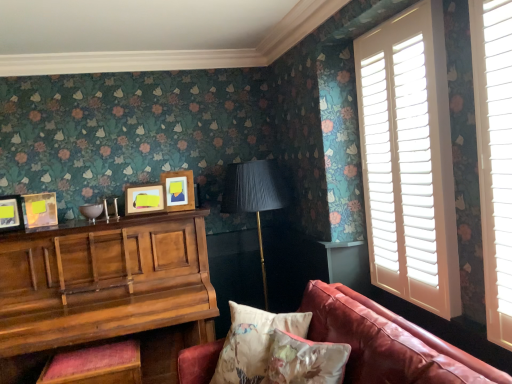
In order to click on free spot in front of matte wooden picture frame at upper center, marked as the 2th picture frame in a right-to-left arrangement in this screenshot , I will do `click(142, 219)`.